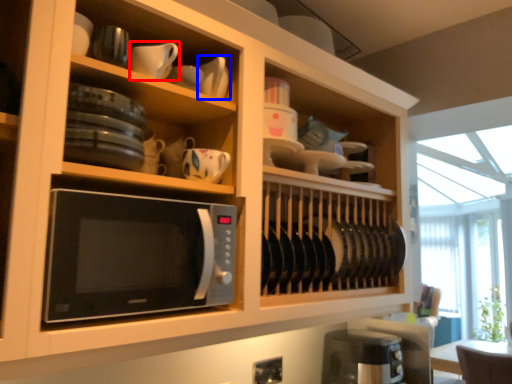
Question: Which object appears closest to the camera in this image, tableware (highlighted by a red box) or tableware (highlighted by a blue box)?

Choices:
 (A) tableware
 (B) tableware

Answer: (A)